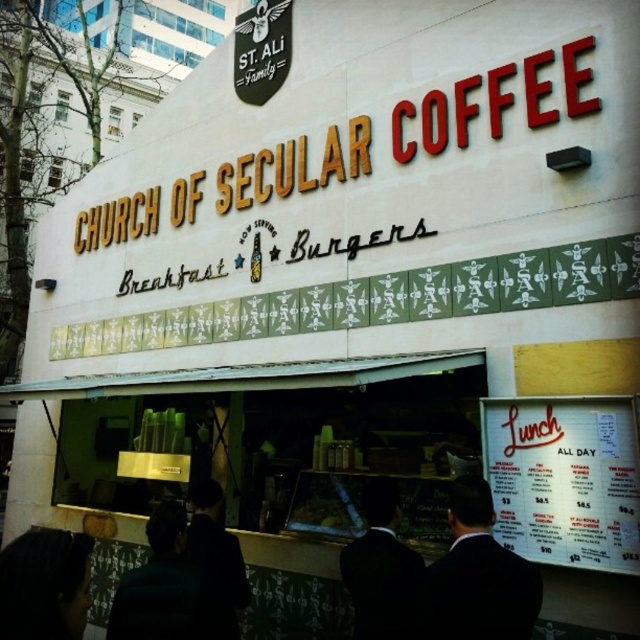
Can you confirm if white paper menu at lower right is positioned below black suit at center?

Actually, white paper menu at lower right is above black suit at center.

Does white paper menu at lower right have a larger size compared to black suit at center?

Yes, white paper menu at lower right is bigger than black suit at center.

Does point (592, 541) lie in front of point (381, 636)?

No, (592, 541) is further to viewer.

Identify the location of white paper menu at lower right. (564, 477).

Between dark brown hair at lower left and dark brown leather jacket at lower left, which one is positioned higher?

dark brown hair at lower left is higher up.

Is dark brown hair at lower left smaller than dark brown leather jacket at lower left?

Incorrect, dark brown hair at lower left is not smaller in size than dark brown leather jacket at lower left.

Does point (88, 605) come closer to viewer compared to point (141, 608)?

Yes, it is in front of point (141, 608).

Find the location of a particular element. dark brown hair at lower left is located at coordinates (44, 584).

Is point (513, 545) more distant than point (128, 637)?

Yes, it is behind point (128, 637).

Between white paper menu at lower right and dark brown leather jacket at lower left, which one appears on the left side from the viewer's perspective?

A: dark brown leather jacket at lower left

Is point (552, 477) closer to camera compared to point (108, 636)?

No, it is not.

Where is `white paper menu at lower right`? The width and height of the screenshot is (640, 640). white paper menu at lower right is located at coordinates (564, 477).